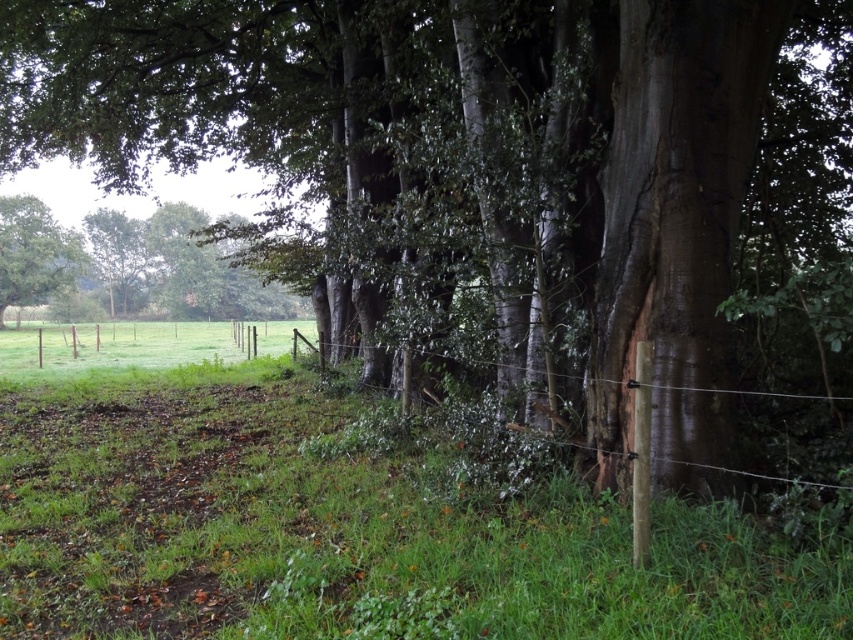
Which is more to the right, green leafy tree at left or wooden post at center-right?

From the viewer's perspective, wooden post at center-right appears more on the right side.

Is point (86, 262) positioned after point (740, 474)?

Yes, point (86, 262) is farther from viewer.

Identify the location of green leafy tree at left. This screenshot has height=640, width=853. (33, 253).